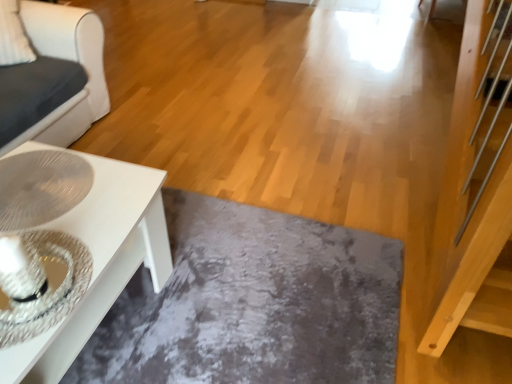
Describe the element at coordinates (253, 303) in the screenshot. This screenshot has height=384, width=512. I see `slate at lower center` at that location.

Measure the distance between point (143, 269) and camera.

1.64 meters.

The image size is (512, 384). In order to click on white glossy table at lower left in this screenshot , I will do `click(100, 259)`.

Locate an element on the screen. table that appears in front of the slate at lower center is located at coordinates (100, 259).

From a real-world perspective, is white glossy table at lower left under slate at lower center?

No, from a real-world perspective, white glossy table at lower left is not beneath slate at lower center.

Does white glossy table at lower left have a larger size compared to slate at lower center?

Correct, white glossy table at lower left is larger in size than slate at lower center.

Is white glossy table at lower left positioned beyond the bounds of slate at lower center?

Absolutely, white glossy table at lower left is external to slate at lower center.

Who is taller, slate at lower center or white glossy table at lower left?

With more height is white glossy table at lower left.

Is slate at lower center facing away from white glossy table at lower left?

No, slate at lower center is not facing away from white glossy table at lower left.

Which object is positioned more to the left, slate at lower center or white glossy table at lower left?

white glossy table at lower left.

How far apart are white glossy coffee table at lower left and slate at lower center?

The distance of white glossy coffee table at lower left from slate at lower center is 1.17 meters.

Considering the sizes of objects white glossy coffee table at lower left and slate at lower center in the image provided, who is wider, white glossy coffee table at lower left or slate at lower center?

slate at lower center is wider.

Is white glossy coffee table at lower left positioned with its back to slate at lower center?

white glossy coffee table at lower left does not have its back to slate at lower center.

How many degrees apart are the facing directions of white glossy coffee table at lower left and slate at lower center?

89.7 degrees.

Is white glossy coffee table at lower left turned away from white glossy table at lower left?

No, white glossy table at lower left is not at the back of white glossy coffee table at lower left.

Considering the positions of objects white glossy coffee table at lower left and white glossy table at lower left in the image provided, who is in front, white glossy coffee table at lower left or white glossy table at lower left?

white glossy table at lower left is closer to the camera.

Is white glossy coffee table at lower left in contact with white glossy table at lower left?

They are not placed beside each other.

What are the coordinates of `furniture on the left of the white glossy table at lower left` in the screenshot? It's located at (54, 77).

From the image's perspective, is slate at lower center located beneath white glossy coffee table at lower left?

Correct, slate at lower center appears lower than white glossy coffee table at lower left in the image.

What are the coordinates of `slate below the white glossy coffee table at lower left (from the image's perspective)` in the screenshot? It's located at (253, 303).

Can we say slate at lower center lies outside white glossy coffee table at lower left?

Yes, slate at lower center is not within white glossy coffee table at lower left.

Is slate at lower center far away from white glossy coffee table at lower left?

Yes, slate at lower center is far from white glossy coffee table at lower left.

From a real-world perspective, who is located lower, white glossy table at lower left or white glossy coffee table at lower left?

In real-world perspective, white glossy table at lower left is lower.

From the picture: From the image's perspective, between white glossy table at lower left and white glossy coffee table at lower left, which one is located above?

From the image's view, white glossy coffee table at lower left is above.

Does white glossy table at lower left have a lesser width compared to white glossy coffee table at lower left?

Correct, the width of white glossy table at lower left is less than that of white glossy coffee table at lower left.

Would you say white glossy table at lower left is to the left or to the right of white glossy coffee table at lower left in the picture?

In the image, white glossy table at lower left appears on the right side of white glossy coffee table at lower left.

At what (x,y) coordinates should I click in order to perform the action: click on slate that is on the right side of white glossy table at lower left. Please return your answer as a coordinate pair (x, y). Image resolution: width=512 pixels, height=384 pixels. Looking at the image, I should click on (253, 303).

Locate an element on the screen. The height and width of the screenshot is (384, 512). table lying above the slate at lower center (from the image's perspective) is located at coordinates (100, 259).

Considering their positions, is slate at lower center positioned further to white glossy table at lower left than white glossy coffee table at lower left?

white glossy coffee table at lower left.

Estimate the real-world distances between objects in this image. Which object is further from slate at lower center, white glossy coffee table at lower left or white glossy table at lower left?

The object further to slate at lower center is white glossy coffee table at lower left.

When comparing their distances from white glossy coffee table at lower left, does white glossy table at lower left or slate at lower center seem further?

Based on the image, slate at lower center appears to be further to white glossy coffee table at lower left.

Consider the image. Looking at the image, which one is located closer to slate at lower center, white glossy table at lower left or white glossy coffee table at lower left?

Among the two, white glossy table at lower left is located nearer to slate at lower center.

From the image, which object appears to be nearer to white glossy coffee table at lower left, slate at lower center or white glossy table at lower left?

Based on the image, white glossy table at lower left appears to be nearer to white glossy coffee table at lower left.

Based on the photo, looking at the image, which one is located closer to white glossy table at lower left, white glossy coffee table at lower left or slate at lower center?

Among the two, slate at lower center is located nearer to white glossy table at lower left.

Locate an element on the screen. This screenshot has height=384, width=512. table between white glossy coffee table at lower left and slate at lower center from left to right is located at coordinates (100, 259).